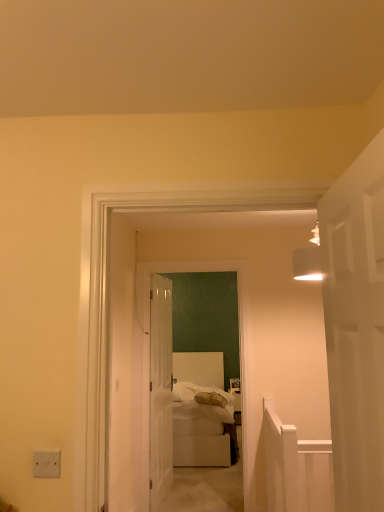
Question: Is white plastic/light switch at lower left shorter than white soft bed at center?

Choices:
 (A) no
 (B) yes

Answer: (B)

Question: Is white plastic/light switch at lower left beside white soft bed at center?

Choices:
 (A) no
 (B) yes

Answer: (A)

Question: Is white plastic/light switch at lower left smaller than white soft bed at center?

Choices:
 (A) yes
 (B) no

Answer: (A)

Question: From a real-world perspective, is white plastic/light switch at lower left physically above white soft bed at center?

Choices:
 (A) no
 (B) yes

Answer: (B)

Question: Is white plastic/light switch at lower left not within white soft bed at center?

Choices:
 (A) yes
 (B) no

Answer: (A)

Question: In terms of width, does clear glass door at center, which ranks as the 1th door in left-to-right order, look wider or thinner when compared to white soft bed at center?

Choices:
 (A) thin
 (B) wide

Answer: (A)

Question: From the image's perspective, is clear glass door at center, which is the first door in back-to-front order, located above or below white soft bed at center?

Choices:
 (A) above
 (B) below

Answer: (A)

Question: Is point (155, 422) positioned closer to the camera than point (196, 379)?

Choices:
 (A) closer
 (B) farther

Answer: (A)

Question: In the image, is clear glass door at center, acting as the 2th door starting from the front, on the left side or the right side of white soft bed at center?

Choices:
 (A) left
 (B) right

Answer: (A)

Question: From the image's perspective, relative to white plastic/light switch at lower left, is white soft bed at center above or below?

Choices:
 (A) above
 (B) below

Answer: (B)

Question: From their relative heights in the image, would you say white soft bed at center is taller or shorter than white plastic/light switch at lower left?

Choices:
 (A) short
 (B) tall

Answer: (B)

Question: Is point (187, 353) positioned closer to the camera than point (57, 460)?

Choices:
 (A) closer
 (B) farther

Answer: (B)

Question: Considering the relative positions of white soft bed at center and white plastic/light switch at lower left in the image provided, is white soft bed at center to the left or to the right of white plastic/light switch at lower left?

Choices:
 (A) right
 (B) left

Answer: (A)

Question: Considering the positions of white soft bed at center and white fluffy bedding at center in the image, is white soft bed at center bigger or smaller than white fluffy bedding at center?

Choices:
 (A) small
 (B) big

Answer: (B)

Question: From a real-world perspective, is white soft bed at center positioned above or below white fluffy bedding at center?

Choices:
 (A) below
 (B) above

Answer: (A)